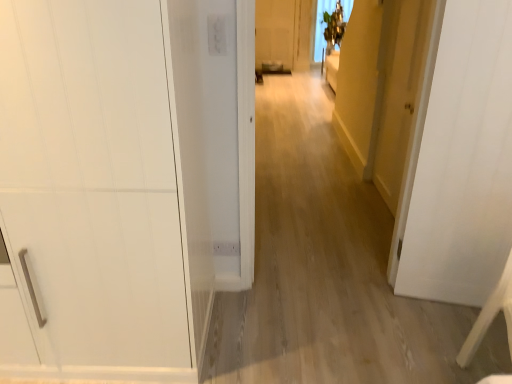
Question: Is white matte door at center, marked as the second door in a left-to-right arrangement, not near white matte cabinet at left, acting as the first door starting from the left?

Choices:
 (A) no
 (B) yes

Answer: (B)

Question: From the image's perspective, would you say white matte door at center, the second door viewed from the right, is shown under white matte cabinet at left, acting as the first door starting from the left?

Choices:
 (A) yes
 (B) no

Answer: (B)

Question: Is white matte door at center, marked as the second door in a left-to-right arrangement, turned away from white matte cabinet at left, acting as the first door starting from the left?

Choices:
 (A) no
 (B) yes

Answer: (A)

Question: From a real-world perspective, is white matte door at center, marked as the second door in a left-to-right arrangement, positioned over white matte cabinet at left, acting as the first door starting from the left, based on gravity?

Choices:
 (A) no
 (B) yes

Answer: (B)

Question: Is white matte door at center, the second door viewed from the right, bigger than white matte cabinet at left, acting as the first door starting from the left?

Choices:
 (A) yes
 (B) no

Answer: (B)

Question: Is white matte cabinet at left, the 3th door in the right-to-left sequence, surrounded by white matte door at center, marked as the second door in a left-to-right arrangement?

Choices:
 (A) yes
 (B) no

Answer: (B)

Question: Is white wood chair at lower right positioned far away from white matte door at center, marked as the second door in a left-to-right arrangement?

Choices:
 (A) yes
 (B) no

Answer: (B)

Question: From a real-world perspective, is white wood chair at lower right positioned over white matte door at center, marked as the second door in a left-to-right arrangement, based on gravity?

Choices:
 (A) yes
 (B) no

Answer: (B)

Question: Is white wood chair at lower right facing away from white matte door at center, marked as the second door in a left-to-right arrangement?

Choices:
 (A) no
 (B) yes

Answer: (B)

Question: Is white wood chair at lower right wider than white matte door at center, marked as the second door in a left-to-right arrangement?

Choices:
 (A) yes
 (B) no

Answer: (A)

Question: From the image's perspective, is white wood chair at lower right located beneath white matte door at center, marked as the second door in a left-to-right arrangement?

Choices:
 (A) no
 (B) yes

Answer: (B)

Question: Is white wood chair at lower right thinner than white matte door at center, marked as the second door in a left-to-right arrangement?

Choices:
 (A) yes
 (B) no

Answer: (B)

Question: Is yellow matte door at right, marked as the 3th door in a left-to-right arrangement, further to camera compared to white matte door at center, marked as the second door in a left-to-right arrangement?

Choices:
 (A) no
 (B) yes

Answer: (B)